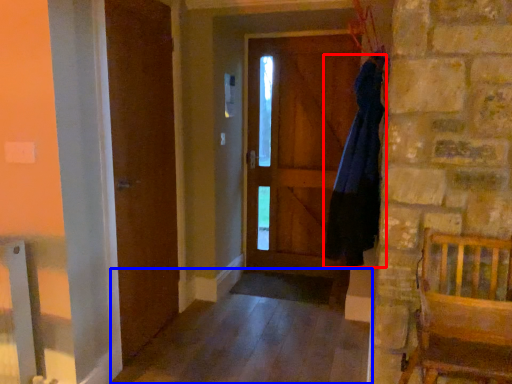
Question: Which point is further to the camera, dress (highlighted by a red box) or alley (highlighted by a blue box)?

Choices:
 (A) dress
 (B) alley

Answer: (A)